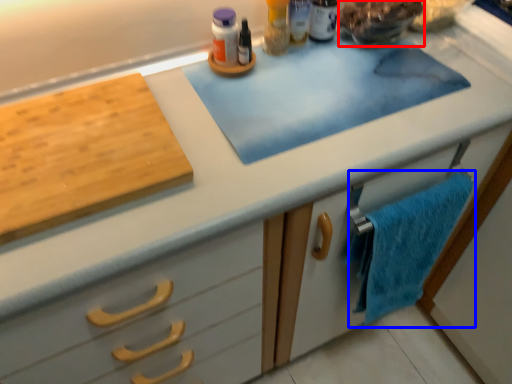
Question: Which point is further to the camera, food (highlighted by a red box) or bath towel (highlighted by a blue box)?

Choices:
 (A) food
 (B) bath towel

Answer: (A)